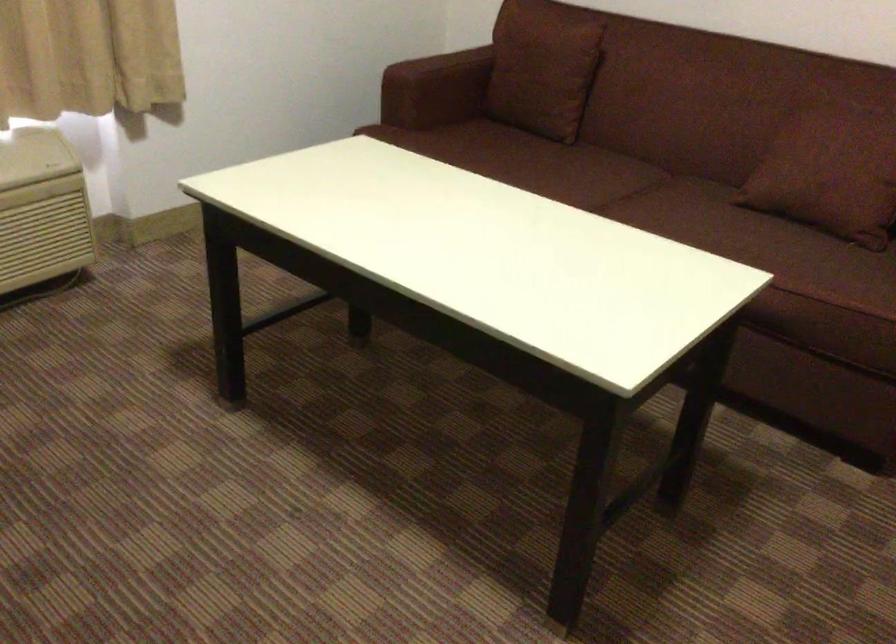
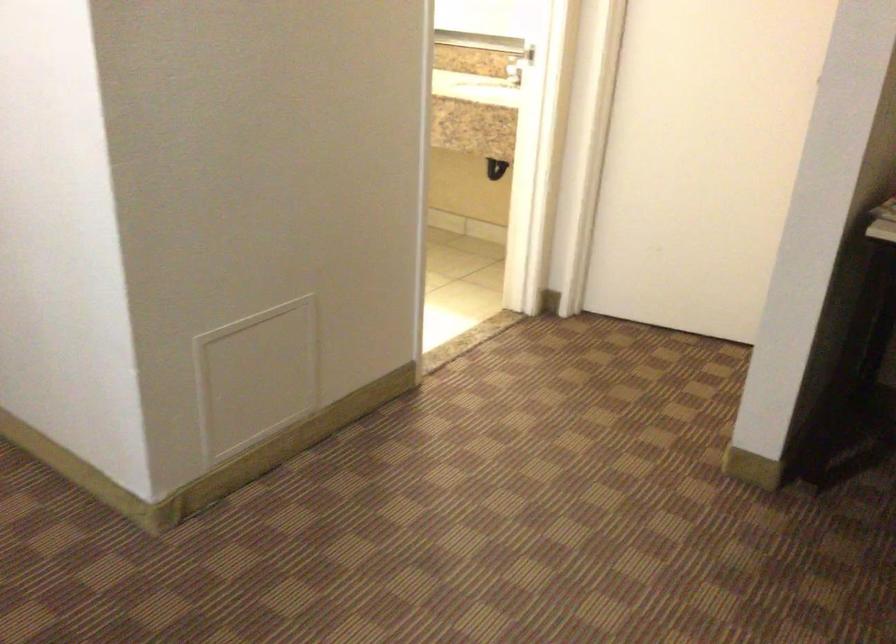
How did the camera likely rotate?

The rotation direction of the camera is right-down.